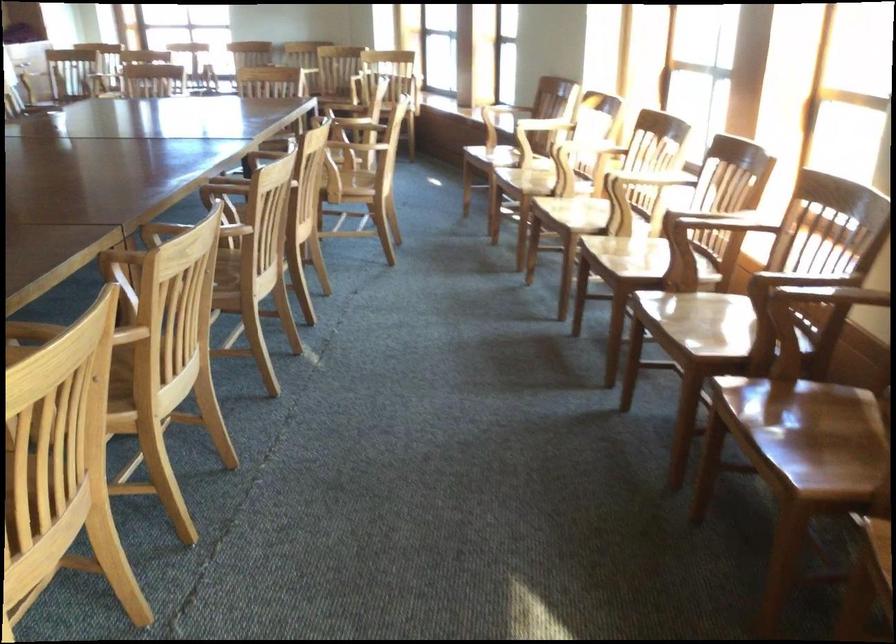
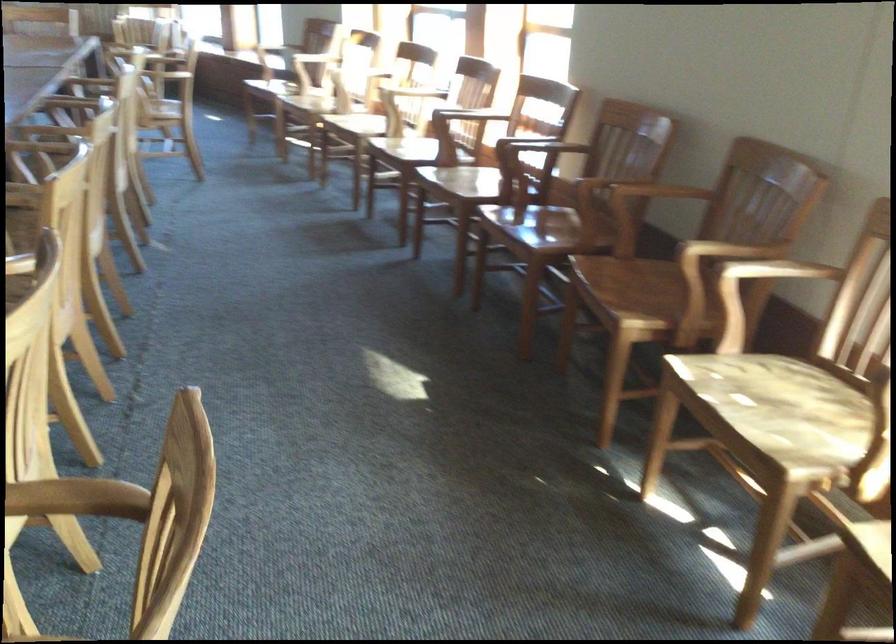
The point at (647,172) is marked in the first image. Where is the corresponding point in the second image?

(410, 91)